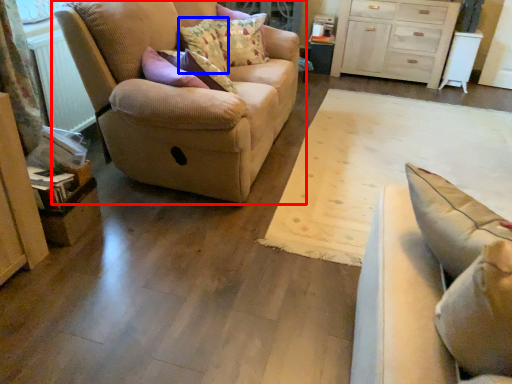
Question: Which object is further to the camera taking this photo, studio couch (highlighted by a red box) or pillow (highlighted by a blue box)?

Choices:
 (A) studio couch
 (B) pillow

Answer: (B)